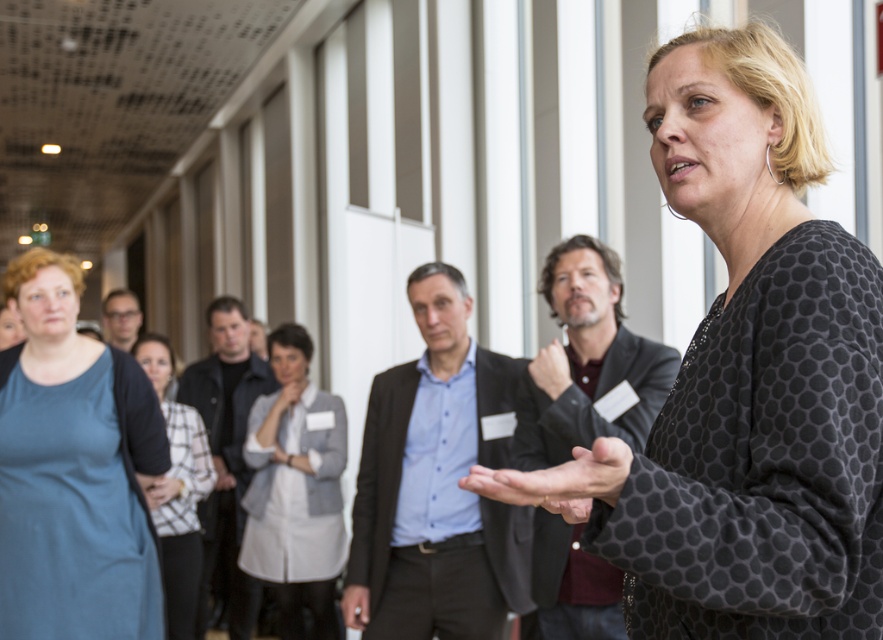
You are standing in the conference room and want to know how far the point at coordinates (x=737, y=420) is from your current position. Can you determine the distance?

The distance of point (x=737, y=420) from camera is 4.12 feet.

You are a fashion designer observing the presentation. You notice two fabrics at the center of the image. Which one is smaller in size between the polka dot fabric at center and the light gray fabric jacket at center?

The polka dot fabric at center is smaller in size compared to the light gray fabric jacket at center.

You are an interior designer observing the presentation setup. The polka dot fabric at center and the matte blue shirt at left are both visible in your view. Which object is positioned higher in the image?

The polka dot fabric at center is above the matte blue shirt at left, so it is positioned higher in the image.